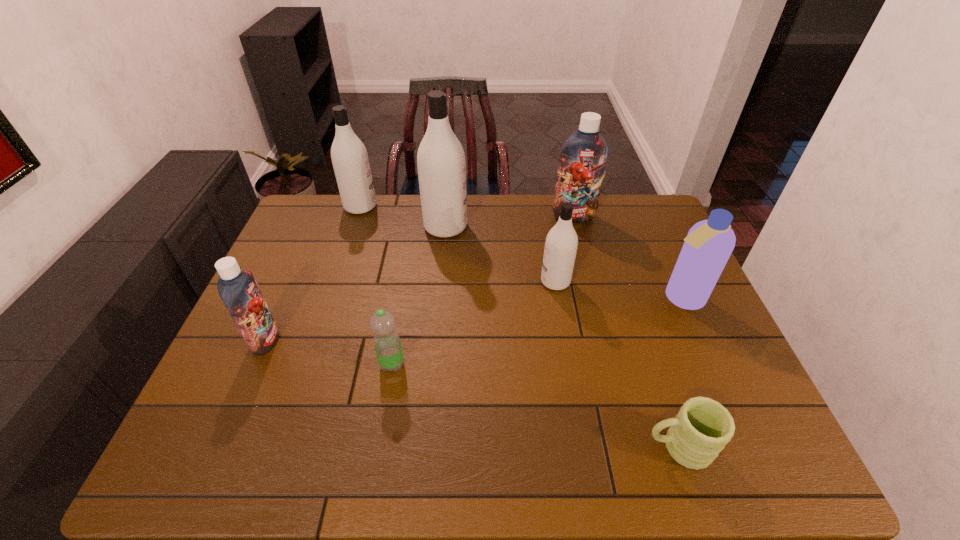
This screenshot has width=960, height=540. In order to click on unoccupied position between the nearest object and the rightmost object in this screenshot , I will do `click(679, 373)`.

The height and width of the screenshot is (540, 960). I want to click on vacant space that's between the bigger blue shampoo and the left blue shampoo, so click(x=420, y=278).

Identify the location of free space between the tallest shampoo and the nearer blue shampoo. This screenshot has width=960, height=540. (x=355, y=284).

This screenshot has height=540, width=960. I want to click on free spot between the shortest object and the second shortest object, so click(535, 406).

Identify the location of empty space between the biggest white shampoo and the fifth shampoo from right to left. The image size is (960, 540). (403, 217).

You are a GUI agent. You are given a task and a screenshot of the screen. Output one action in this format:
    pyautogui.click(x=<x>, y=<y>)
    Task: Click on the free area in between the tallest object and the mug
    
    Given the screenshot: What is the action you would take?
    pyautogui.click(x=562, y=337)

Find the location of a particular element. vacant area between the nearest object and the farther blue shampoo is located at coordinates (626, 332).

The height and width of the screenshot is (540, 960). I want to click on object identified as the third closest to the right blue shampoo, so click(709, 243).

Identify the location of object identified as the fifth closest to the bigger blue shampoo. This screenshot has width=960, height=540. (387, 344).

Image resolution: width=960 pixels, height=540 pixels. I want to click on the fourth closest shampoo to the rightmost shampoo, so click(x=349, y=156).